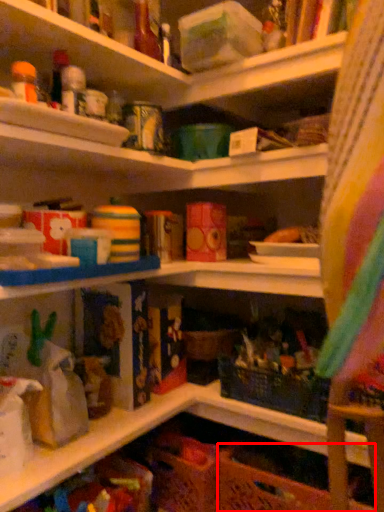
Question: From the image's perspective, where is basket (annotated by the red box) located in relation to shelf in the image?

Choices:
 (A) above
 (B) below

Answer: (B)